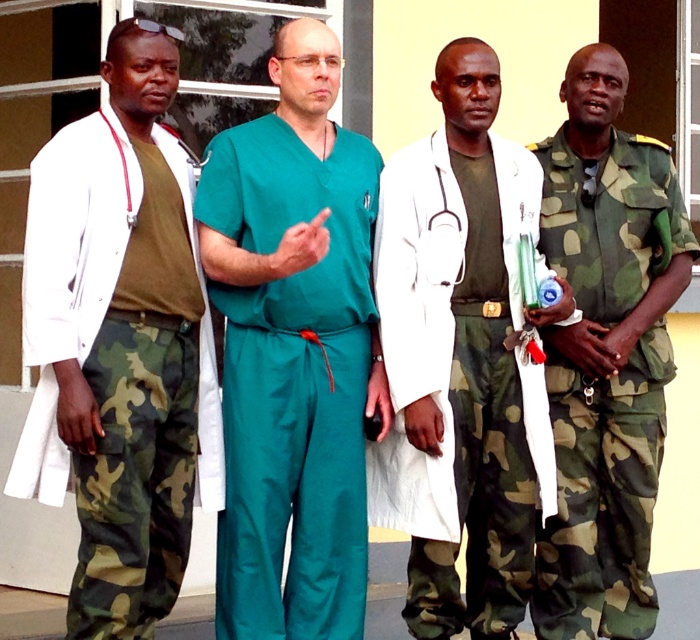
Question: Does teal smooth scrubs at center appear under camo fabric uniform at right?

Choices:
 (A) yes
 (B) no

Answer: (B)

Question: Which object is closer to the camera taking this photo?

Choices:
 (A) teal smooth scrubs at center
 (B) camo fabric uniform at right

Answer: (A)

Question: Is teal smooth scrubs at center further to camera compared to camo fabric pants at left?

Choices:
 (A) yes
 (B) no

Answer: (A)

Question: Can you confirm if teal smooth scrubs at center is positioned above camo fabric pants at left?

Choices:
 (A) yes
 (B) no

Answer: (B)

Question: Which object is the farthest from the camo fabric uniform at right?

Choices:
 (A) camo fabric pants at left
 (B) teal smooth scrubs at center
 (C) white matte coat at center

Answer: (A)

Question: Among these objects, which one is nearest to the camera?

Choices:
 (A) white matte coat at center
 (B) teal smooth scrubs at center
 (C) camo fabric pants at left

Answer: (C)